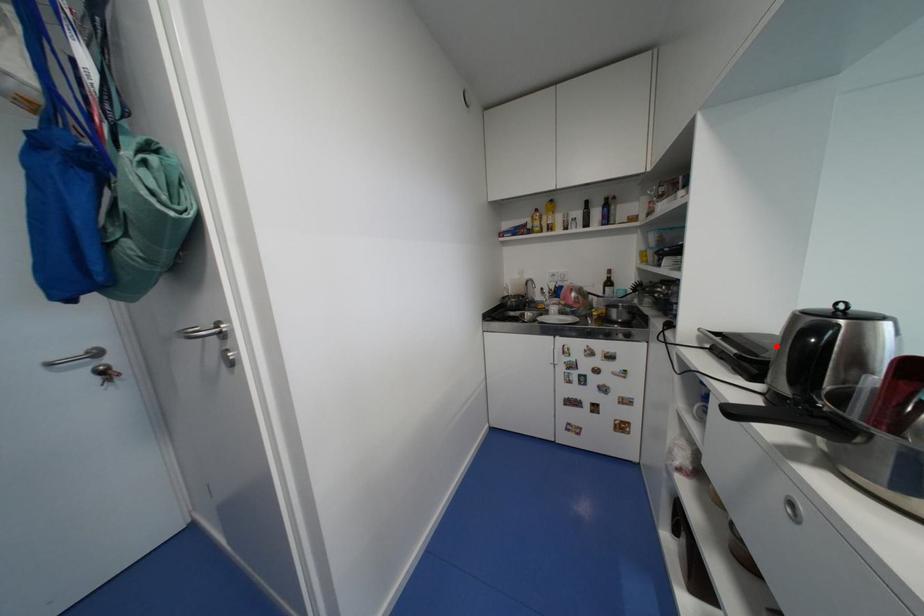
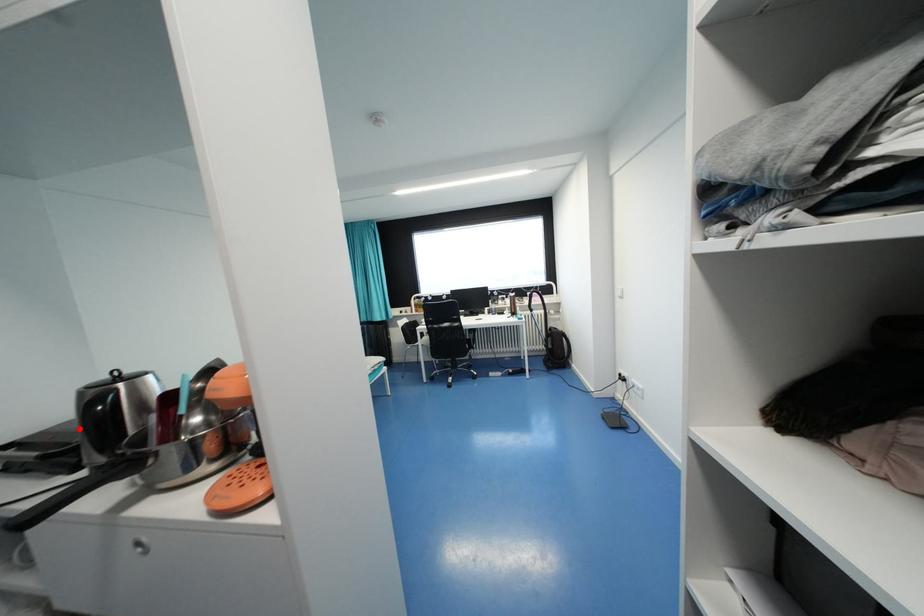
I am providing you with two images of the same scene from different viewpoints. A red point is marked on the first image and another point is marked on the second image. Do the highlighted points in image1 and image2 indicate the same real-world spot?

Yes